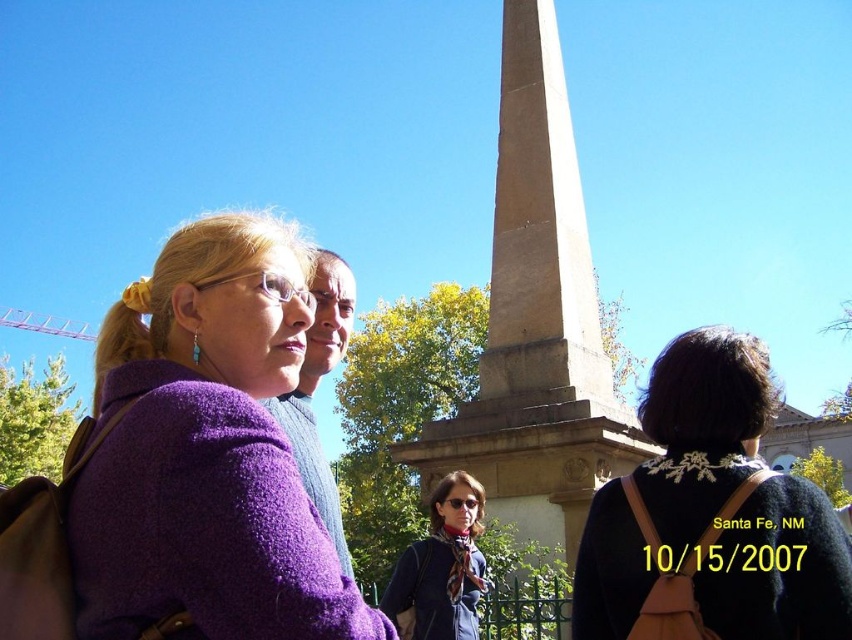
Question: Which object is the closest to the matte purple sweater at center?

Choices:
 (A) black lace sweater at upper right
 (B) purple fuzzy coat at left

Answer: (A)

Question: Which of these objects is positioned closest to the brown stone obelisk at center?

Choices:
 (A) black lace sweater at upper right
 (B) matte purple sweater at center
 (C) purple fuzzy coat at left

Answer: (B)

Question: Can you confirm if brown stone obelisk at center is bigger than matte purple sweater at center?

Choices:
 (A) no
 (B) yes

Answer: (B)

Question: Is brown stone obelisk at center closer to the viewer compared to matte purple sweater at center?

Choices:
 (A) no
 (B) yes

Answer: (A)

Question: Can you confirm if purple fuzzy coat at left is positioned above matte purple sweater at center?

Choices:
 (A) no
 (B) yes

Answer: (B)

Question: Among these points, which one is nearest to the camera?

Choices:
 (A) (170, 243)
 (B) (476, 600)
 (C) (677, 483)

Answer: (A)